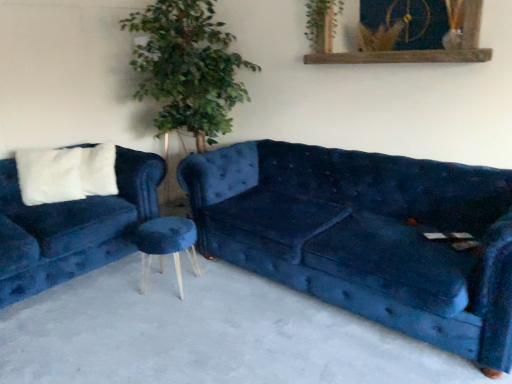
Question: Is velvet blue couch at left, arranged as the 2th studio couch when viewed from the right, facing towards green leafy plant at upper center?

Choices:
 (A) yes
 (B) no

Answer: (B)

Question: Would you consider velvet blue couch at left, arranged as the 2th studio couch when viewed from the right, to be distant from green leafy plant at upper center?

Choices:
 (A) yes
 (B) no

Answer: (A)

Question: Can you confirm if velvet blue couch at left, arranged as the 2th studio couch when viewed from the right, is taller than green leafy plant at upper center?

Choices:
 (A) no
 (B) yes

Answer: (B)

Question: Can you confirm if velvet blue couch at left, arranged as the 2th studio couch when viewed from the right, is bigger than green leafy plant at upper center?

Choices:
 (A) yes
 (B) no

Answer: (A)

Question: Is velvet blue couch at left, which is the first studio couch from left to right, looking in the opposite direction of green leafy plant at upper center?

Choices:
 (A) yes
 (B) no

Answer: (B)

Question: Does velvet blue couch at left, arranged as the 2th studio couch when viewed from the right, have a lesser width compared to green leafy plant at upper center?

Choices:
 (A) yes
 (B) no

Answer: (B)

Question: Is velvet blue couch at center, which is the 1th studio couch from right to left, behind rustic wood picture frame at upper center?

Choices:
 (A) no
 (B) yes

Answer: (A)

Question: Is velvet blue couch at center, which is the 1th studio couch from right to left, shorter than rustic wood picture frame at upper center?

Choices:
 (A) yes
 (B) no

Answer: (B)

Question: From the image's perspective, is velvet blue couch at center, which is the 1th studio couch from right to left, located above rustic wood picture frame at upper center?

Choices:
 (A) no
 (B) yes

Answer: (A)

Question: Is velvet blue couch at center, which is the 1th studio couch from right to left, taller than rustic wood picture frame at upper center?

Choices:
 (A) no
 (B) yes

Answer: (B)

Question: Can you confirm if velvet blue couch at center, which is the 1th studio couch from right to left, is smaller than rustic wood picture frame at upper center?

Choices:
 (A) yes
 (B) no

Answer: (B)

Question: Is velvet blue couch at center, which is the 1th studio couch from right to left, positioned beyond the bounds of rustic wood picture frame at upper center?

Choices:
 (A) no
 (B) yes

Answer: (B)

Question: From the image's perspective, is green leafy plant at upper center above velvet blue couch at left, which is the first studio couch from left to right?

Choices:
 (A) no
 (B) yes

Answer: (B)